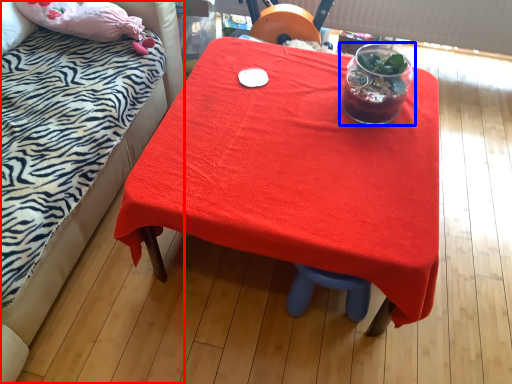
Question: Which of the following is the farthest to the observer, bed (highlighted by a red box) or tableware (highlighted by a blue box)?

Choices:
 (A) bed
 (B) tableware

Answer: (B)